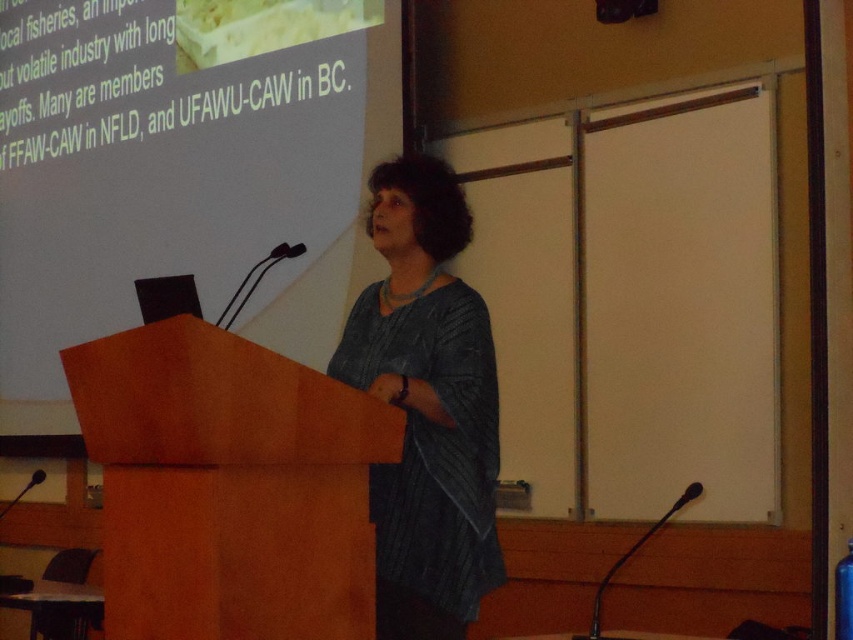
Which of these two, wooden podium at center or textured gray sweater at center, stands shorter?

wooden podium at center is shorter.

Who is lower down, wooden podium at center or textured gray sweater at center?

wooden podium at center

Between point (173, 497) and point (467, 611), which one is positioned behind?

Point (467, 611)

The height and width of the screenshot is (640, 853). Find the location of `wooden podium at center`. wooden podium at center is located at coordinates (228, 484).

Can you confirm if white matte projection screen at upper center is positioned below textured gray sweater at center?

Actually, white matte projection screen at upper center is above textured gray sweater at center.

Identify the location of white matte projection screen at upper center. This screenshot has height=640, width=853. (166, 157).

The height and width of the screenshot is (640, 853). I want to click on white matte projection screen at upper center, so 166,157.

Does white matte projection screen at upper center have a lesser height compared to wooden podium at center?

No, white matte projection screen at upper center is not shorter than wooden podium at center.

Can you confirm if white matte projection screen at upper center is thinner than wooden podium at center?

No, white matte projection screen at upper center is not thinner than wooden podium at center.

Find the location of a particular element. white matte projection screen at upper center is located at coordinates click(166, 157).